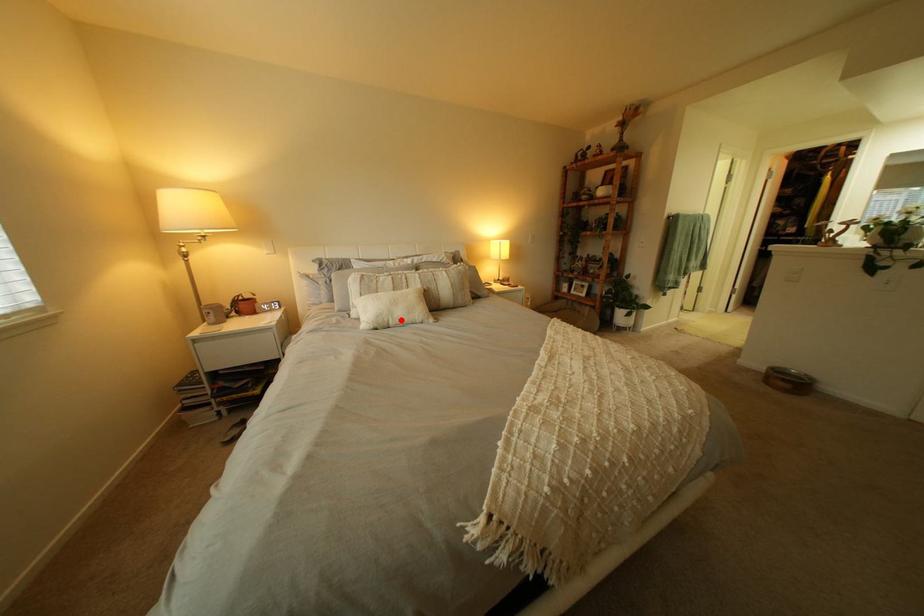
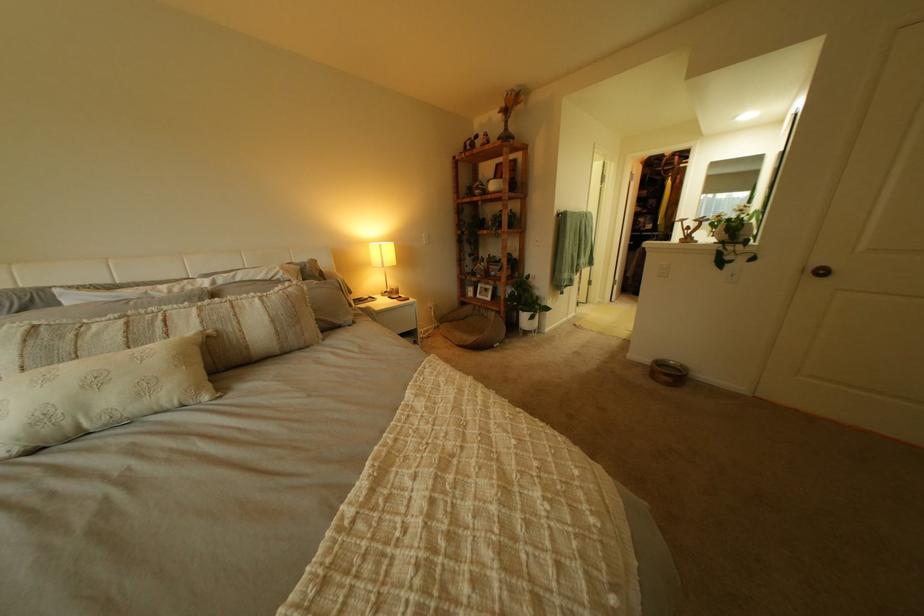
Find the pixel in the second image that matches the highlighted location in the first image.

(80, 424)